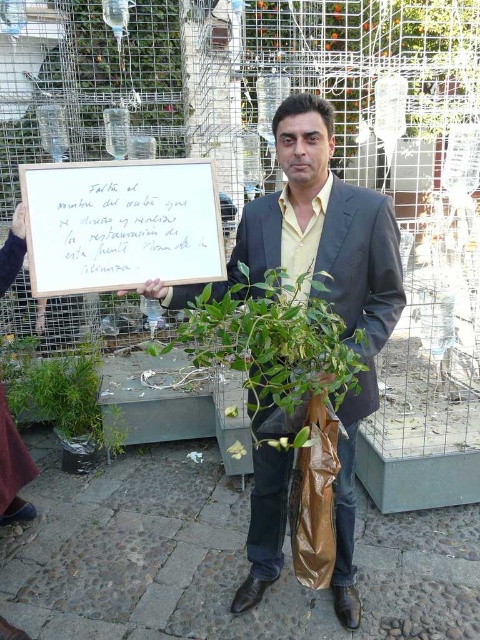
Question: Which point is closer to the camera?

Choices:
 (A) (116, 188)
 (B) (348, 545)

Answer: (A)

Question: Does green leafy plant at lower left have a smaller size compared to brown plastic bag at center?

Choices:
 (A) yes
 (B) no

Answer: (B)

Question: Can you confirm if matte black suit at center is positioned above green leafy plant at lower left?

Choices:
 (A) no
 (B) yes

Answer: (B)

Question: Can you confirm if green leafy plant at lower left is thinner than brown plastic bag at center?

Choices:
 (A) yes
 (B) no

Answer: (B)

Question: Which object is positioned farthest from the matte black suit at center?

Choices:
 (A) green leafy plant at center
 (B) white paper at center
 (C) green leafy plant at lower left

Answer: (C)

Question: Considering the real-world distances, which object is farthest from the matte black suit at center?

Choices:
 (A) green leafy plant at center
 (B) white paper at center
 (C) green leafy plant at lower left
 (D) brown plastic bag at center

Answer: (C)